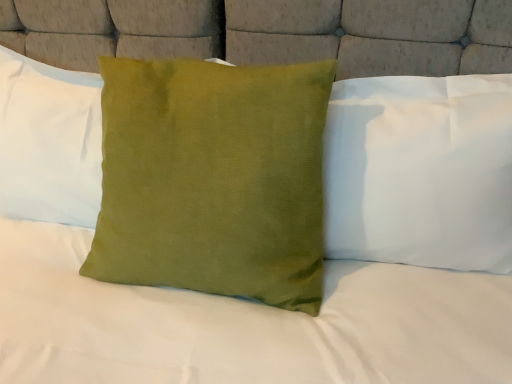
Question: From the image's perspective, does satin green pillow at center, placed as the 1th pillow when sorted from right to left, appear higher than green velvet cushion at center, marked as the second pillow in a right-to-left arrangement?

Choices:
 (A) no
 (B) yes

Answer: (B)

Question: Is satin green pillow at center, placed as the 1th pillow when sorted from right to left, outside green velvet cushion at center, marked as the second pillow in a right-to-left arrangement?

Choices:
 (A) no
 (B) yes

Answer: (B)

Question: Does satin green pillow at center, placed as the 1th pillow when sorted from right to left, turn towards green velvet cushion at center, positioned as the 2th pillow in left-to-right order?

Choices:
 (A) yes
 (B) no

Answer: (B)

Question: Is satin green pillow at center, arranged as the third pillow when viewed from the left, at the left side of green velvet cushion at center, marked as the second pillow in a right-to-left arrangement?

Choices:
 (A) yes
 (B) no

Answer: (B)

Question: Considering the relative sizes of satin green pillow at center, placed as the 1th pillow when sorted from right to left, and green velvet cushion at center, positioned as the 2th pillow in left-to-right order, in the image provided, is satin green pillow at center, placed as the 1th pillow when sorted from right to left, shorter than green velvet cushion at center, positioned as the 2th pillow in left-to-right order,?

Choices:
 (A) yes
 (B) no

Answer: (A)

Question: From the image's perspective, is green velvet cushion at center, positioned as the 2th pillow in left-to-right order, located above or below green velvet pillow at center, positioned as the first pillow in left-to-right order?

Choices:
 (A) above
 (B) below

Answer: (B)

Question: From a real-world perspective, is green velvet cushion at center, positioned as the 2th pillow in left-to-right order, above or below green velvet pillow at center, the 3th pillow when ordered from right to left?

Choices:
 (A) above
 (B) below

Answer: (B)

Question: In the image, is green velvet cushion at center, marked as the second pillow in a right-to-left arrangement, positioned in front of or behind green velvet pillow at center, positioned as the first pillow in left-to-right order?

Choices:
 (A) front
 (B) behind

Answer: (A)

Question: Is green velvet cushion at center, marked as the second pillow in a right-to-left arrangement, wider or thinner than green velvet pillow at center, positioned as the first pillow in left-to-right order?

Choices:
 (A) thin
 (B) wide

Answer: (B)

Question: Considering the relative positions of satin green pillow at center, arranged as the third pillow when viewed from the left, and green velvet pillow at center, positioned as the first pillow in left-to-right order, in the image provided, is satin green pillow at center, arranged as the third pillow when viewed from the left, to the left or to the right of green velvet pillow at center, positioned as the first pillow in left-to-right order,?

Choices:
 (A) right
 (B) left

Answer: (A)

Question: Is satin green pillow at center, placed as the 1th pillow when sorted from right to left, taller or shorter than green velvet pillow at center, positioned as the first pillow in left-to-right order?

Choices:
 (A) short
 (B) tall

Answer: (B)

Question: From a real-world perspective, is satin green pillow at center, placed as the 1th pillow when sorted from right to left, physically located above or below green velvet pillow at center, positioned as the first pillow in left-to-right order?

Choices:
 (A) below
 (B) above

Answer: (A)

Question: Would you say satin green pillow at center, placed as the 1th pillow when sorted from right to left, is inside or outside green velvet pillow at center, positioned as the first pillow in left-to-right order?

Choices:
 (A) inside
 (B) outside

Answer: (B)

Question: In terms of width, does green velvet pillow at center, the 3th pillow when ordered from right to left, look wider or thinner when compared to satin green pillow at center, placed as the 1th pillow when sorted from right to left?

Choices:
 (A) wide
 (B) thin

Answer: (B)

Question: From the image's perspective, relative to satin green pillow at center, placed as the 1th pillow when sorted from right to left, is green velvet pillow at center, the 3th pillow when ordered from right to left, above or below?

Choices:
 (A) below
 (B) above

Answer: (B)